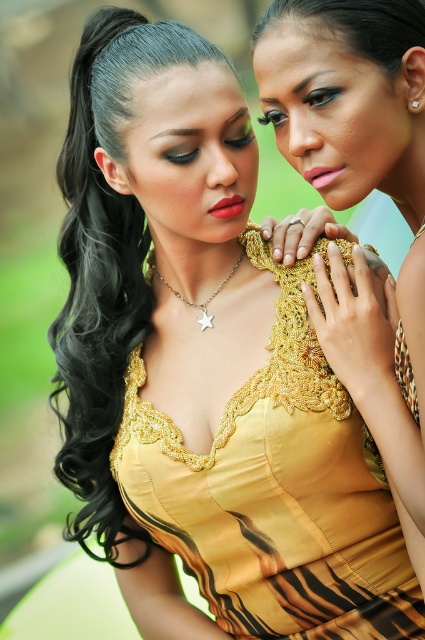
You are a photographer adjusting the lighting for a portrait. You need to ensure that both the black shiny hair at left and the pink matte lipstick at center are well lit. Given their distance apart, what is the minimum width of the lighting equipment needed to cover both subjects adequately?

The distance between the black shiny hair at left and the pink matte lipstick at center is 58.05 centimeters, so the lighting equipment must be at least 58.05 centimeters wide to cover both subjects adequately.

Looking at this image, you are standing in front of a photo of two people. The photo has a point at coordinates point [136,301]. If you want to focus your camera lens on that point, what distance should you set it to?

The point [136,301] is 4.95 feet from the viewer, so you should set the camera lens to focus at 4.95 feet.